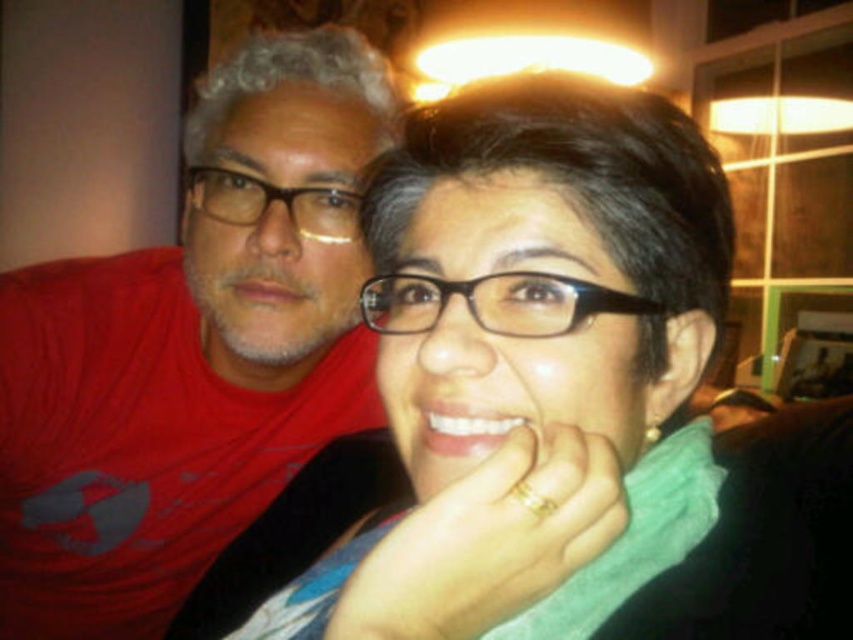
Question: Which is farther from the matte black glasses at center?

Choices:
 (A) matte red t-shirt at left
 (B) matte black glasses at upper left

Answer: (A)

Question: Can you confirm if matte black glasses at center is positioned to the right of black plastic glasses at center?

Choices:
 (A) yes
 (B) no

Answer: (A)

Question: Which point is farther from the camera taking this photo?

Choices:
 (A) (202, 324)
 (B) (593, 378)
 (C) (495, 288)
 (D) (287, 192)

Answer: (A)

Question: Does matte red t-shirt at left appear over matte black glasses at upper left?

Choices:
 (A) no
 (B) yes

Answer: (A)

Question: Which of the following is the farthest from the observer?

Choices:
 (A) (589, 472)
 (B) (479, 291)

Answer: (B)

Question: Does matte black glasses at center have a larger size compared to matte red t-shirt at left?

Choices:
 (A) no
 (B) yes

Answer: (A)